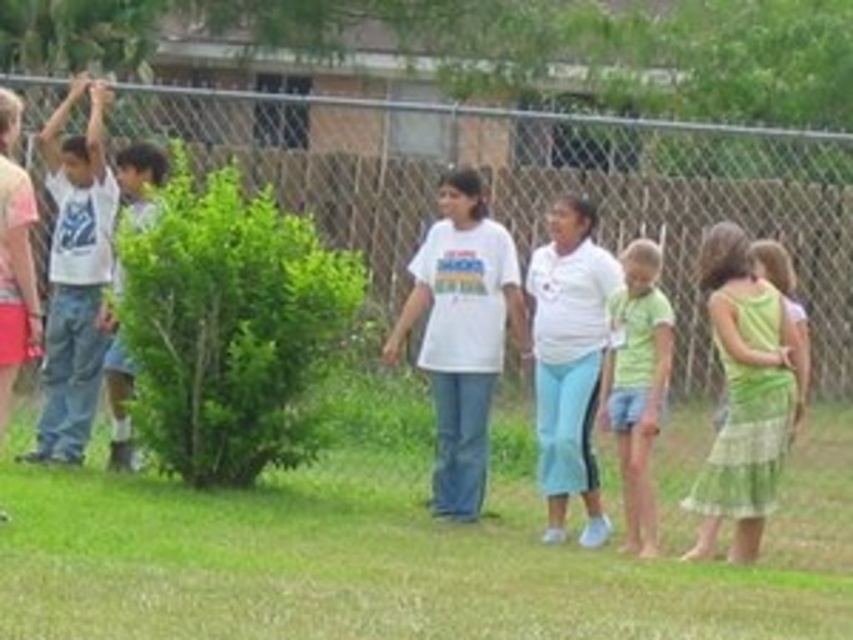
Question: Which of the following is the closest to the observer?

Choices:
 (A) (236, 560)
 (B) (13, 202)
 (C) (293, 176)

Answer: (B)

Question: Which of the following is the closest to the observer?

Choices:
 (A) green striped dress at right
 (B) green grass at lower center
 (C) white cotton shirt at left
 (D) green cotton shirt at center

Answer: (B)

Question: Can you confirm if white cotton shirt at center is wider than white cotton shirt at left?

Choices:
 (A) no
 (B) yes

Answer: (B)

Question: Is chain-link fence at upper center below matte white shirt at left?

Choices:
 (A) yes
 (B) no

Answer: (A)

Question: Is chain-link fence at upper center bigger than matte white shirt at left?

Choices:
 (A) no
 (B) yes

Answer: (A)

Question: Estimate the real-world distances between objects in this image. Which object is farther from the white cotton shirt at center?

Choices:
 (A) green cotton shirt at center
 (B) green striped dress at right
 (C) chain-link fence at upper center

Answer: (C)